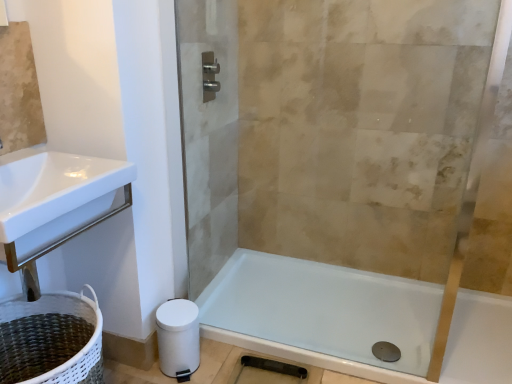
Question: Could you tell me if white woven laundry basket at lower left is facing clear glass shower door at center?

Choices:
 (A) no
 (B) yes

Answer: (A)

Question: Is white woven laundry basket at lower left completely or partially outside of clear glass shower door at center?

Choices:
 (A) no
 (B) yes

Answer: (B)

Question: Considering the relative sizes of white woven laundry basket at lower left and clear glass shower door at center in the image provided, is white woven laundry basket at lower left smaller than clear glass shower door at center?

Choices:
 (A) no
 (B) yes

Answer: (A)

Question: Is white woven laundry basket at lower left positioned with its back to clear glass shower door at center?

Choices:
 (A) no
 (B) yes

Answer: (A)

Question: Does white woven laundry basket at lower left come behind clear glass shower door at center?

Choices:
 (A) no
 (B) yes

Answer: (A)

Question: Is white woven laundry basket at lower left touching clear glass shower door at center?

Choices:
 (A) yes
 (B) no

Answer: (B)

Question: Can you confirm if satin nickel towel bar at upper center is smaller than white matte toilet paper at lower left?

Choices:
 (A) yes
 (B) no

Answer: (A)

Question: Is satin nickel towel bar at upper center at the right side of white matte toilet paper at lower left?

Choices:
 (A) yes
 (B) no

Answer: (A)

Question: Is satin nickel towel bar at upper center not inside white matte toilet paper at lower left?

Choices:
 (A) yes
 (B) no

Answer: (A)

Question: From the image's perspective, does satin nickel towel bar at upper center appear higher than white matte toilet paper at lower left?

Choices:
 (A) yes
 (B) no

Answer: (A)

Question: From the image's perspective, is satin nickel towel bar at upper center under white matte toilet paper at lower left?

Choices:
 (A) no
 (B) yes

Answer: (A)

Question: Could you tell me if satin nickel towel bar at upper center is turned towards white matte toilet paper at lower left?

Choices:
 (A) yes
 (B) no

Answer: (B)

Question: From the image's perspective, is white woven laundry basket at lower left located above white matte toilet paper at lower left?

Choices:
 (A) yes
 (B) no

Answer: (B)